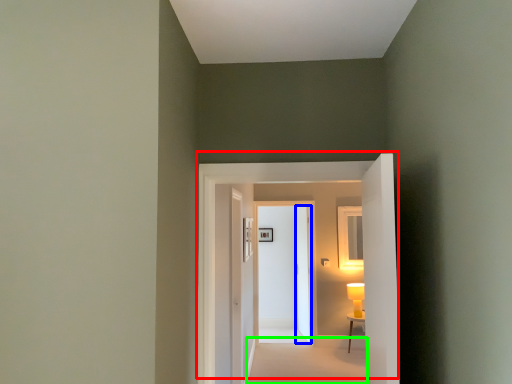
Question: Considering the real-world distances, which object is closest to door (highlighted by a red box)? door (highlighted by a blue box) or path (highlighted by a green box).

Choices:
 (A) door
 (B) path

Answer: (B)